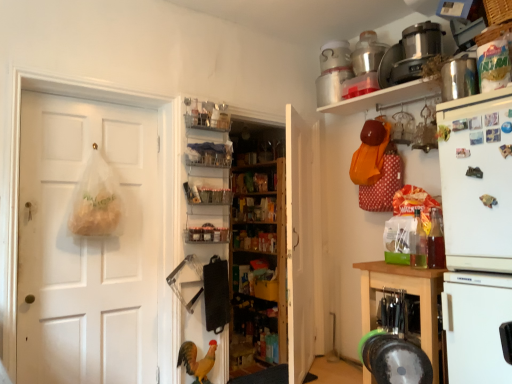
Question: Is metallic silver magnet at upper right, the 2th magnet positioned from the top, facing away from metallic rectangular magnet at upper right, the first magnet in the top-to-bottom sequence?

Choices:
 (A) no
 (B) yes

Answer: (A)

Question: Is metallic silver magnet at upper right, the 2th magnet positioned from the top, surrounding metallic rectangular magnet at upper right, the first magnet in the top-to-bottom sequence?

Choices:
 (A) no
 (B) yes

Answer: (A)

Question: Can you confirm if metallic silver magnet at upper right, the 2th magnet positioned from the top, is bigger than metallic rectangular magnet at upper right, the 2th magnet ordered from the bottom?

Choices:
 (A) no
 (B) yes

Answer: (B)

Question: Can you confirm if metallic silver magnet at upper right, the 2th magnet positioned from the top, is thinner than metallic rectangular magnet at upper right, the 2th magnet ordered from the bottom?

Choices:
 (A) yes
 (B) no

Answer: (B)

Question: Considering the relative positions of metallic silver magnet at upper right, the 2th magnet positioned from the top, and metallic rectangular magnet at upper right, the 2th magnet ordered from the bottom, in the image provided, is metallic silver magnet at upper right, the 2th magnet positioned from the top, behind metallic rectangular magnet at upper right, the 2th magnet ordered from the bottom,?

Choices:
 (A) yes
 (B) no

Answer: (B)

Question: Is metallic silver magnet at upper right, which is the 1th magnet from bottom to top, facing towards metallic rectangular magnet at upper right, the 2th magnet ordered from the bottom?

Choices:
 (A) no
 (B) yes

Answer: (A)

Question: Is clear plastic shelves at center, placed as the second shelf when sorted from top to bottom, taller than metallic silver magnet at upper right, which is the 1th magnet from bottom to top?

Choices:
 (A) no
 (B) yes

Answer: (B)

Question: From the image's perspective, is clear plastic shelves at center, acting as the third shelf starting from the bottom, over metallic silver magnet at upper right, which is the 1th magnet from bottom to top?

Choices:
 (A) yes
 (B) no

Answer: (A)

Question: From the image's perspective, is clear plastic shelves at center, placed as the second shelf when sorted from top to bottom, below metallic silver magnet at upper right, the 2th magnet positioned from the top?

Choices:
 (A) yes
 (B) no

Answer: (B)

Question: Is metallic silver magnet at upper right, which is the 1th magnet from bottom to top, at the back of clear plastic shelves at center, acting as the third shelf starting from the bottom?

Choices:
 (A) yes
 (B) no

Answer: (B)

Question: From a real-world perspective, is clear plastic shelves at center, placed as the second shelf when sorted from top to bottom, on metallic silver magnet at upper right, the 2th magnet positioned from the top?

Choices:
 (A) yes
 (B) no

Answer: (A)

Question: Could metallic silver magnet at upper right, which is the 1th magnet from bottom to top, be considered to be inside clear plastic shelves at center, acting as the 4th shelf starting from the right?

Choices:
 (A) no
 (B) yes

Answer: (A)

Question: Would you consider wooden shelves at center, the 1th bookshelf in the back-to-front sequence, to be distant from metallic stainless steel container at upper right, marked as the second appliance in a back-to-front arrangement?

Choices:
 (A) yes
 (B) no

Answer: (A)